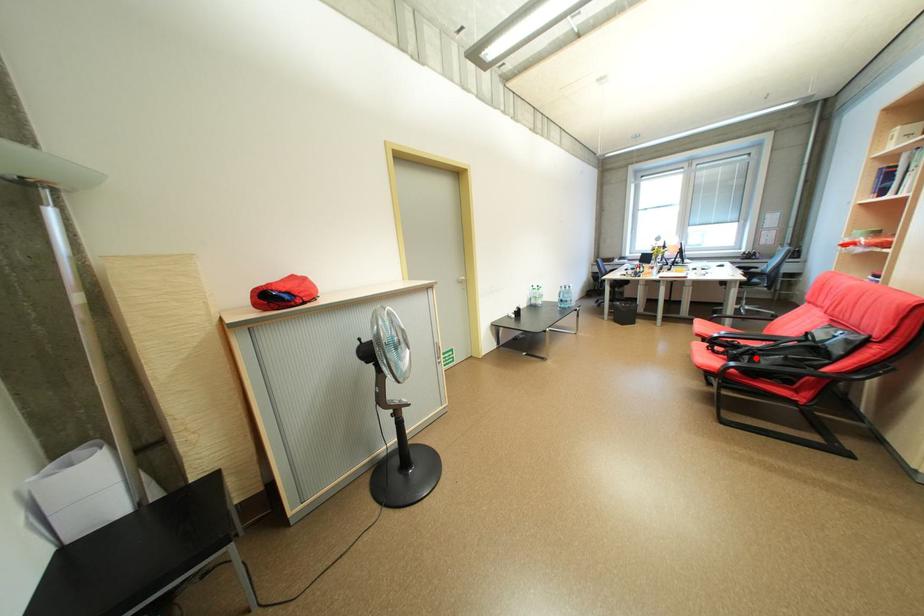
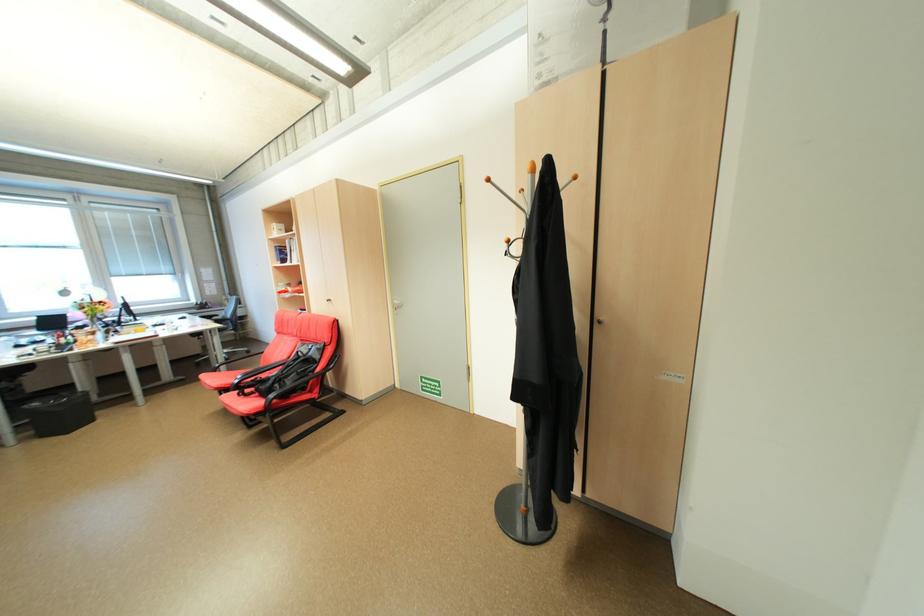
Find the pixel in the second image that matches the highlighted location in the first image.

(286, 386)